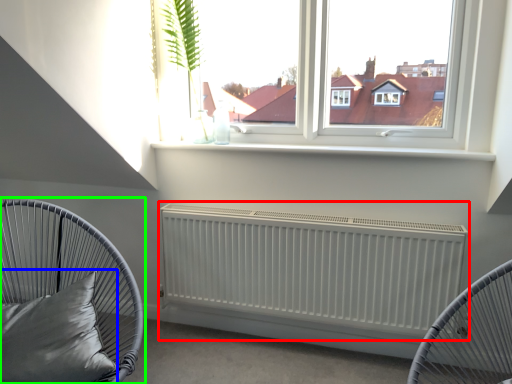
Question: Based on their relative distances, which object is nearer to radiator (highlighted by a red box)? Choose from pillow (highlighted by a blue box) and furniture (highlighted by a green box).

Choices:
 (A) pillow
 (B) furniture

Answer: (B)